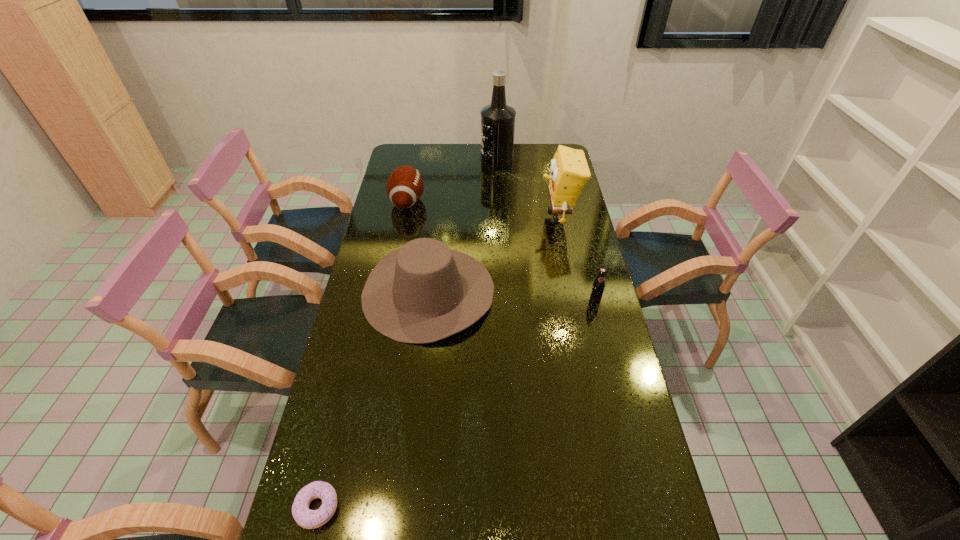
Identify the location of empty space that is in between the fifth shortest object and the football. Image resolution: width=960 pixels, height=540 pixels. (483, 210).

You are a GUI agent. You are given a task and a screenshot of the screen. Output one action in this format:
    pyautogui.click(x=<x>, y=<y>)
    Task: Click on the vacant space that is in between the sponge and the pop
    The width and height of the screenshot is (960, 540).
    Given the screenshot: What is the action you would take?
    pyautogui.click(x=577, y=258)

Where is `vacant area between the football and the liquor`? This screenshot has height=540, width=960. vacant area between the football and the liquor is located at coordinates (452, 181).

This screenshot has width=960, height=540. In order to click on free space between the pop and the tallest object in this screenshot , I will do `click(546, 230)`.

You are a GUI agent. You are given a task and a screenshot of the screen. Output one action in this format:
    pyautogui.click(x=<x>, y=<y>)
    Task: Click on the fifth closest object relative to the sponge
    This screenshot has height=540, width=960.
    Given the screenshot: What is the action you would take?
    pyautogui.click(x=310, y=519)

The width and height of the screenshot is (960, 540). I want to click on the third closest object to the football, so click(x=569, y=171).

Where is `vacant area that satisfies the following two spatial constraints: 1. on the front label of the farthest object; 2. on the front side of the doughnut`? vacant area that satisfies the following two spatial constraints: 1. on the front label of the farthest object; 2. on the front side of the doughnut is located at coordinates (515, 508).

You are a GUI agent. You are given a task and a screenshot of the screen. Output one action in this format:
    pyautogui.click(x=<x>, y=<y>)
    Task: Click on the vacant region that satisfies the following two spatial constraints: 1. on the back side of the cowboy hat; 2. on the left side of the shortest object
    
    Given the screenshot: What is the action you would take?
    pyautogui.click(x=370, y=292)

Identify the location of vacant position in the image that satisfies the following two spatial constraints: 1. on the back side of the shortest object; 2. on the left side of the cowboy hat. coord(370,292).

You are a GUI agent. You are given a task and a screenshot of the screen. Output one action in this format:
    pyautogui.click(x=<x>, y=<y>)
    Task: Click on the vacant space that satisfies the following two spatial constraints: 1. on the laces of the football; 2. on the right side of the cowboy hat
    This screenshot has width=960, height=540.
    Given the screenshot: What is the action you would take?
    pyautogui.click(x=390, y=292)